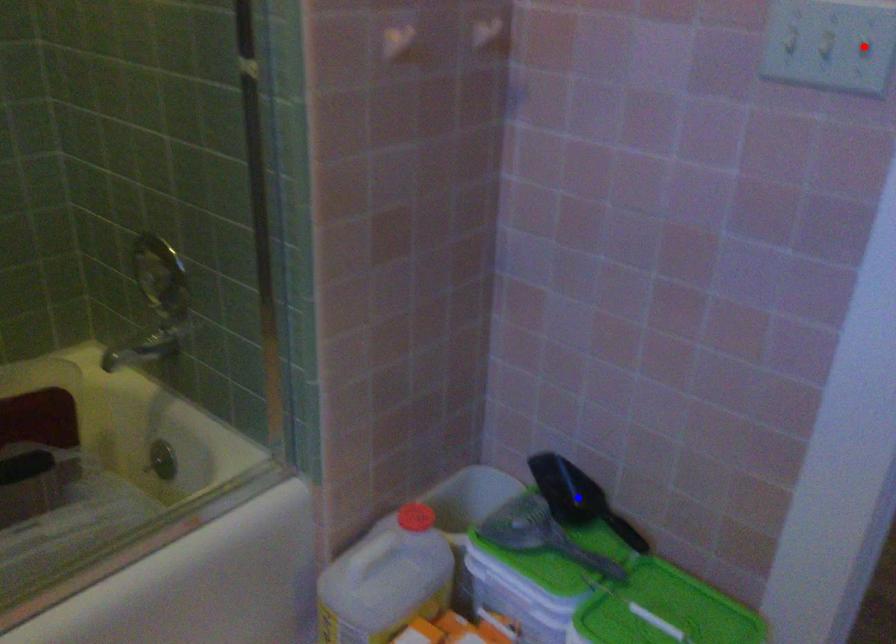
Question: Which of the two points in the image is closer to the camera?

Choices:
 (A) Blue point is closer.
 (B) Red point is closer.

Answer: (B)